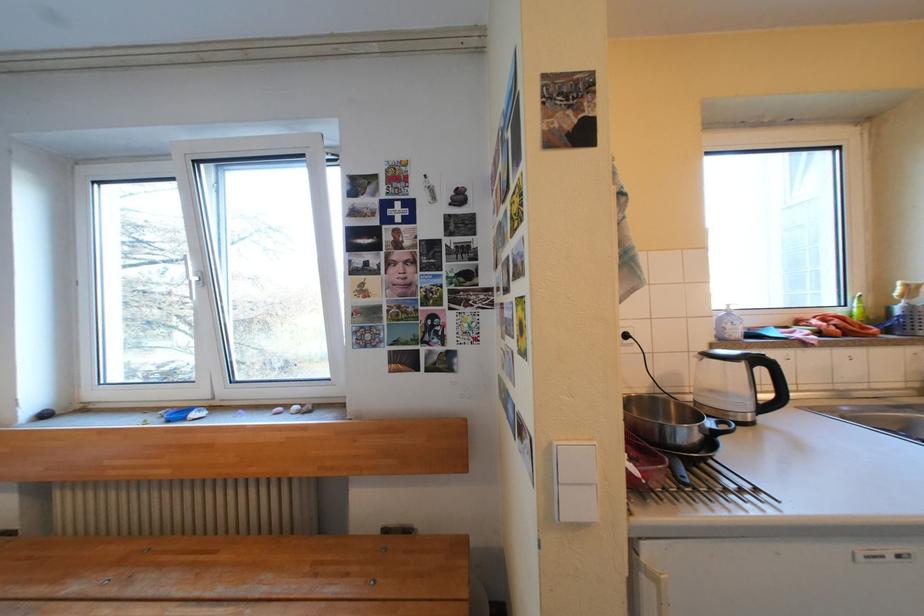
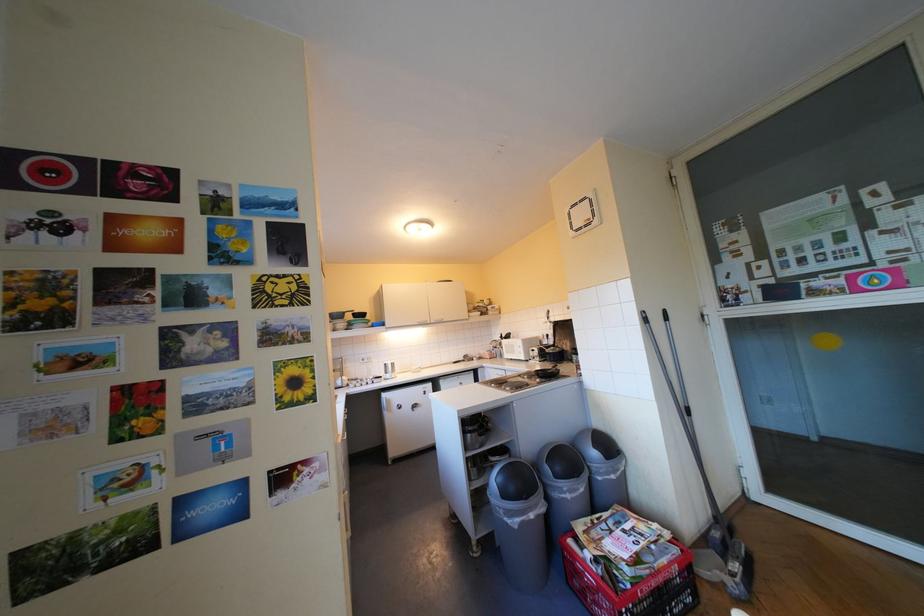
Question: The camera is either moving clockwise (left) or counter-clockwise (right) around the object. The first image is from the beginning of the video and the second image is from the end. Is the camera moving left or right when shooting the video?

Choices:
 (A) Left
 (B) Right

Answer: (A)